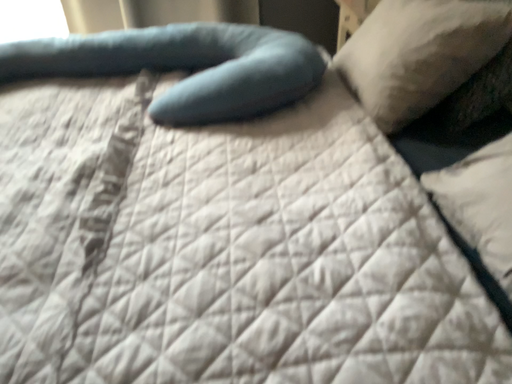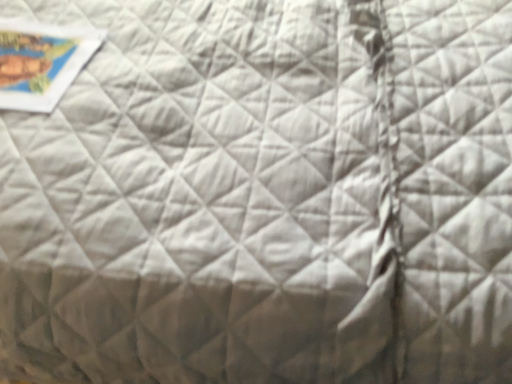
Question: Which way did the camera rotate in the video?

Choices:
 (A) rotated left
 (B) rotated right

Answer: (A)